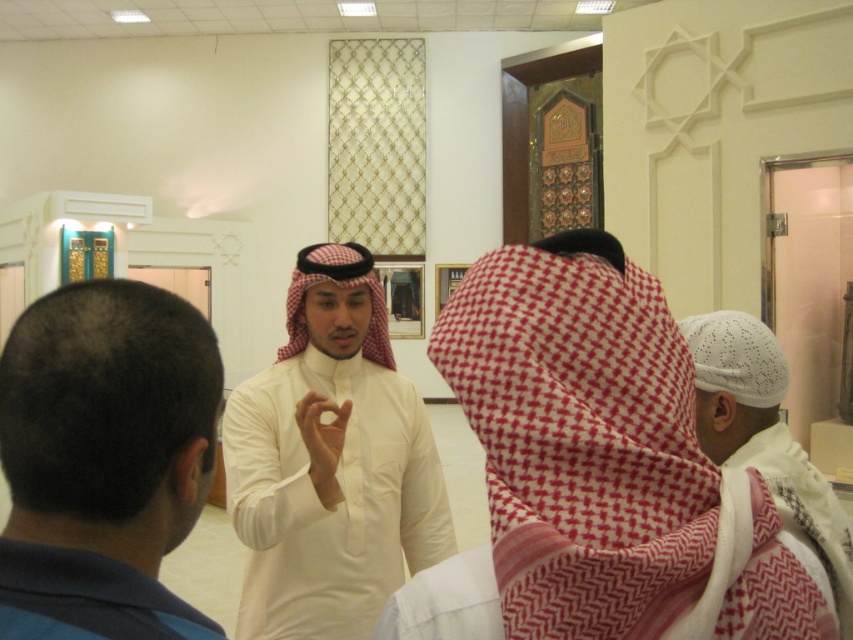
You are standing in the mosque and notice two items of interest. One is the dark blue hair at back and the other is the blue fabric robe at lower left. Which of these two items is taller?

The dark blue hair at back is taller than the blue fabric robe at lower left.

You are an observer standing in the room. You notice two items in the scene described as dark blue hair at back and white knitted cap at center. Which of these items is located behind the other?

The dark blue hair at back is positioned over the white knitted cap at center, meaning it is located behind the cap.